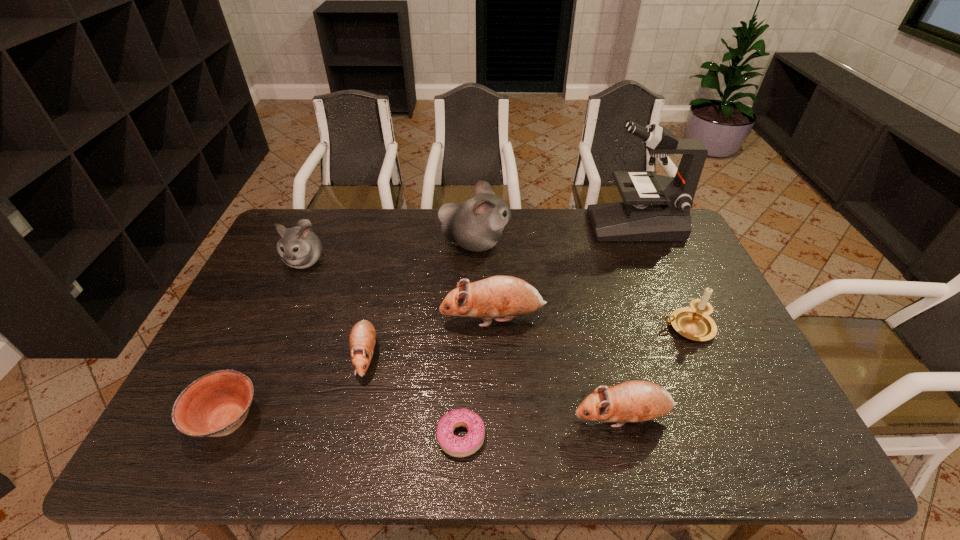
Find the location of `brown hamster that is the closest one to the left white hamster`. brown hamster that is the closest one to the left white hamster is located at coordinates (362, 339).

Locate an element on the screen. Image resolution: width=960 pixels, height=540 pixels. the closest brown hamster to the biggest brown hamster is located at coordinates (362, 339).

The height and width of the screenshot is (540, 960). In order to click on free region that satisfies the following two spatial constraints: 1. on the face of the right white hamster; 2. on the face of the smaller white hamster in this screenshot , I will do `click(475, 260)`.

Locate an element on the screen. Image resolution: width=960 pixels, height=540 pixels. vacant point that satisfies the following two spatial constraints: 1. at the face of the smallest brown hamster; 2. on the left side of the pink doughnut is located at coordinates (347, 437).

Identify the location of free spot that satisfies the following two spatial constraints: 1. on the face of the tallest hamster; 2. on the front side of the pink doughnut. Image resolution: width=960 pixels, height=540 pixels. (472, 437).

You are a GUI agent. You are given a task and a screenshot of the screen. Output one action in this format:
    pyautogui.click(x=<x>, y=<y>)
    Task: Click on the vacant space that satisfies the following two spatial constraints: 1. at the face of the second biggest brown hamster; 2. on the front side of the bowl
    The image size is (960, 540).
    Given the screenshot: What is the action you would take?
    pyautogui.click(x=623, y=421)

I want to click on vacant space that satisfies the following two spatial constraints: 1. on the face of the bigger white hamster; 2. on the face of the left white hamster, so click(475, 260).